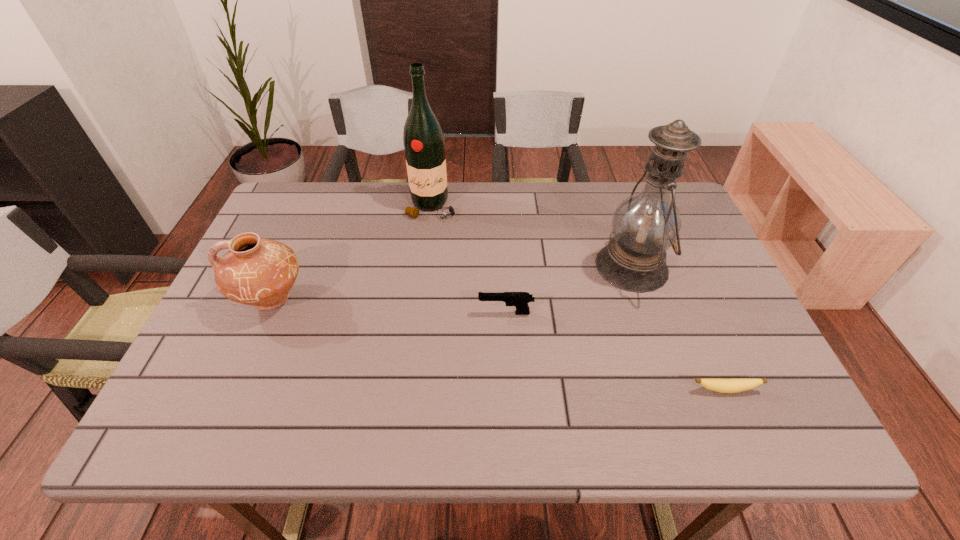
Image resolution: width=960 pixels, height=540 pixels. Identify the location of free location at the near edge. (399, 435).

In the image, there is a desktop. Identify the location of blank space at the left edge. (217, 352).

The image size is (960, 540). Find the location of `free space at the right edge`. free space at the right edge is located at coordinates (752, 353).

Locate an element on the screen. Image resolution: width=960 pixels, height=540 pixels. free region at the far left corner of the desktop is located at coordinates [322, 193].

At what (x,y) coordinates should I click in order to perform the action: click on vacant space at the near left corner of the desktop. Please return your answer as a coordinate pair (x, y). Looking at the image, I should click on (227, 413).

In the image, there is a desktop. At what (x,y) coordinates should I click in order to perform the action: click on free space at the near right corner. Please return your answer as a coordinate pair (x, y). Image resolution: width=960 pixels, height=540 pixels. Looking at the image, I should click on (745, 431).

Identify the location of empty space that is in between the nearest object and the leftmost object. (498, 344).

This screenshot has height=540, width=960. I want to click on unoccupied area between the third object from right to left and the nearest object, so click(615, 351).

At what (x,y) coordinates should I click in order to perform the action: click on vacant space in between the oil lamp and the fourth object from right to left. Please return your answer as a coordinate pair (x, y). Looking at the image, I should click on (532, 237).

Identify the location of vacant area between the pistol and the wine bottle. (468, 260).